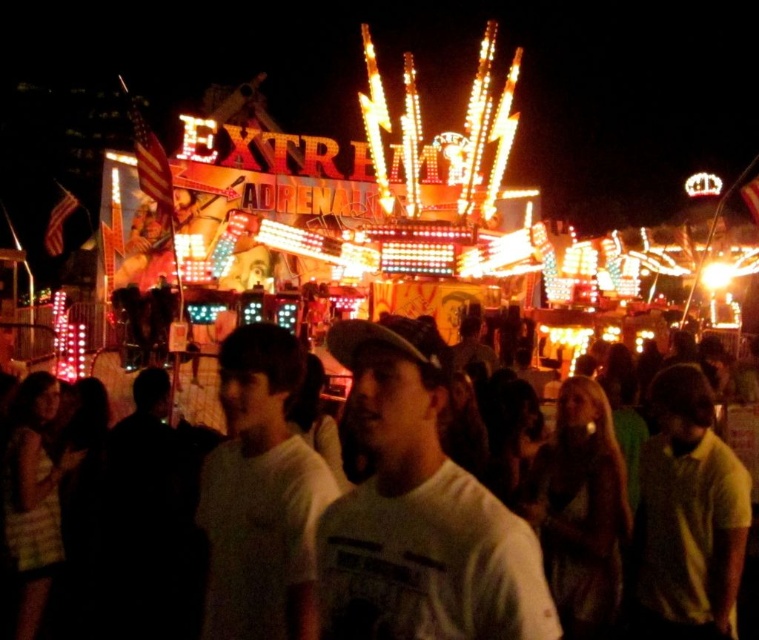
You are a photographer standing at the edge of the fairground, and you want to capture both the white matte shirt at center and the white cotton shirt at center in a single photo. Given that your camera has a maximum focus range of 20 feet, will you be able to include both shirts in the frame without moving closer?

The distance between the white matte shirt at center and the white cotton shirt at center is 21.14 feet, which exceeds the camera maximum focus range of 20 feet. Therefore, you cannot include both shirts in the frame without moving closer.

You are at the fairground and want to find the white matte shirt at center. According to the scene description, where should you look relative to the main attraction sign?

The white matte shirt at center is located at point coordinates relative to the main attraction sign. Since the coordinates are given as 0.809 in the x and 0.552 in the y, it is positioned to the right and slightly below the center of the main attraction sign.